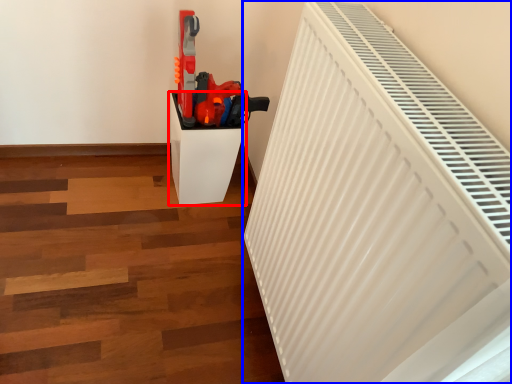
Question: Which object appears farthest to the camera in this image, furniture (highlighted by a red box) or radiator (highlighted by a blue box)?

Choices:
 (A) furniture
 (B) radiator

Answer: (A)